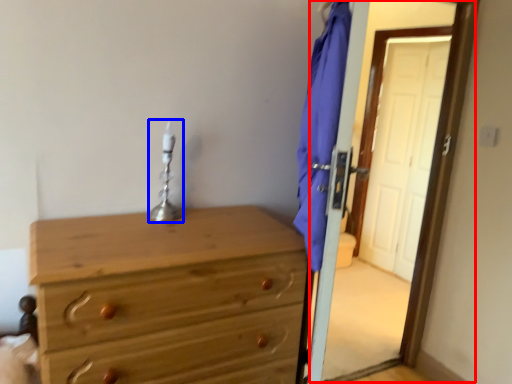
Question: Which object is further to the camera taking this photo, screen door (highlighted by a red box) or table lamp (highlighted by a blue box)?

Choices:
 (A) screen door
 (B) table lamp

Answer: (B)